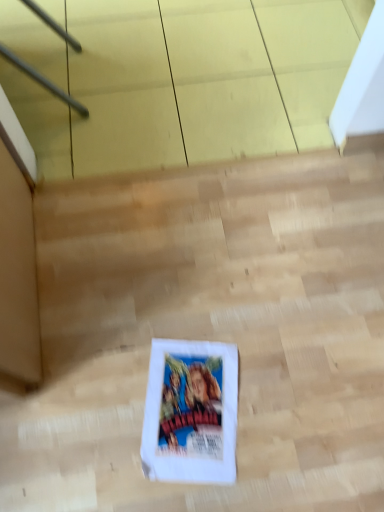
Question: From a real-world perspective, is white paper comic book at center positioned above or below white paper bag at center?

Choices:
 (A) above
 (B) below

Answer: (B)

Question: Is white paper comic book at center taller or shorter than white paper bag at center?

Choices:
 (A) tall
 (B) short

Answer: (B)

Question: Is white paper comic book at center wider or thinner than white paper bag at center?

Choices:
 (A) thin
 (B) wide

Answer: (A)

Question: From a real-world perspective, is white paper bag at center positioned above or below white paper comic book at center?

Choices:
 (A) above
 (B) below

Answer: (A)

Question: Considering the relative positions of white paper bag at center and white paper comic book at center in the image provided, is white paper bag at center to the left or to the right of white paper comic book at center?

Choices:
 (A) right
 (B) left

Answer: (A)

Question: Considering the positions of white paper bag at center and white paper comic book at center in the image, is white paper bag at center taller or shorter than white paper comic book at center?

Choices:
 (A) short
 (B) tall

Answer: (B)

Question: Is white paper bag at center in front of or behind white paper comic book at center in the image?

Choices:
 (A) behind
 (B) front

Answer: (B)